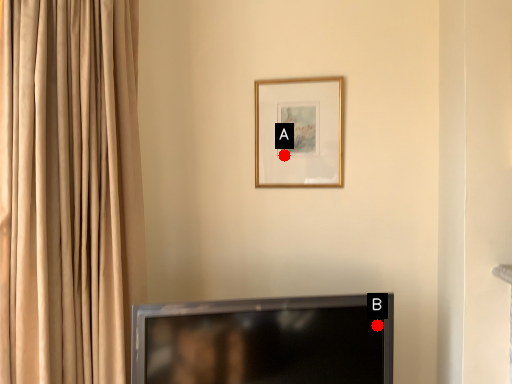
Question: Two points are circled on the image, labeled by A and B beside each circle. Which point is farther to the camera?

Choices:
 (A) A is further
 (B) B is further

Answer: (A)